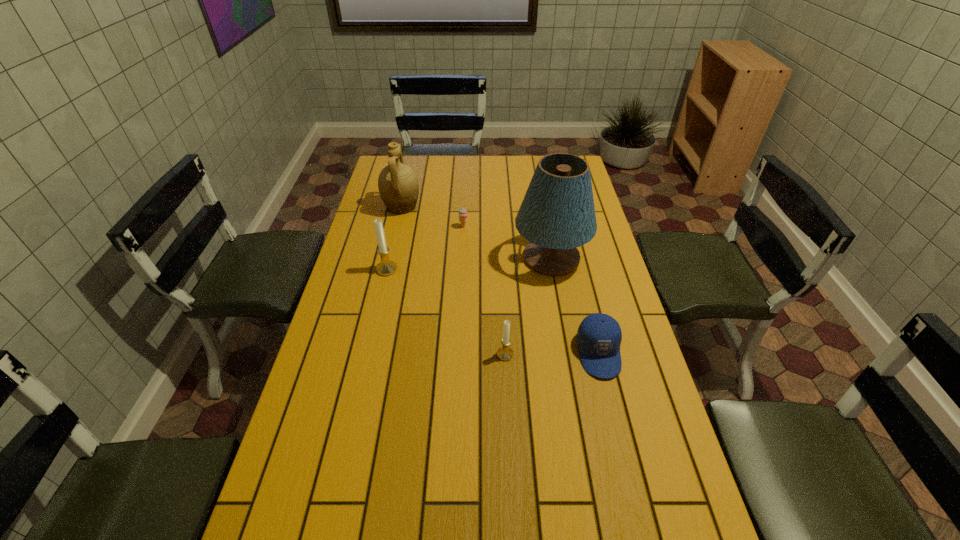
Where is `vacant area at the far edge`? vacant area at the far edge is located at coordinates (437, 171).

At what (x,y) coordinates should I click in order to perform the action: click on free location at the left edge of the desktop. Please return your answer as a coordinate pair (x, y). Looking at the image, I should click on (360, 420).

Identify the location of vacant point located between the pitcher and the fifth nearest object. (433, 217).

Where is `free space between the right candle holder and the cap`? free space between the right candle holder and the cap is located at coordinates (552, 354).

The width and height of the screenshot is (960, 540). In order to click on vacant point located between the third tallest object and the tallest object in this screenshot , I will do `click(468, 264)`.

At what (x,y) coordinates should I click in order to perform the action: click on vacant area between the taller candle holder and the cap. Please return your answer as a coordinate pair (x, y). Looking at the image, I should click on (492, 311).

Where is `unoccupied position between the nearer candle holder and the cap`? The height and width of the screenshot is (540, 960). unoccupied position between the nearer candle holder and the cap is located at coordinates (552, 354).

This screenshot has width=960, height=540. What are the coordinates of `free space between the sherbert and the nearer candle holder` in the screenshot? It's located at (485, 291).

Find the location of a particular element. free spot between the sherbert and the lampshade is located at coordinates (507, 242).

This screenshot has width=960, height=540. What are the coordinates of `free space between the tallest object and the nearer candle holder` in the screenshot? It's located at click(x=528, y=306).